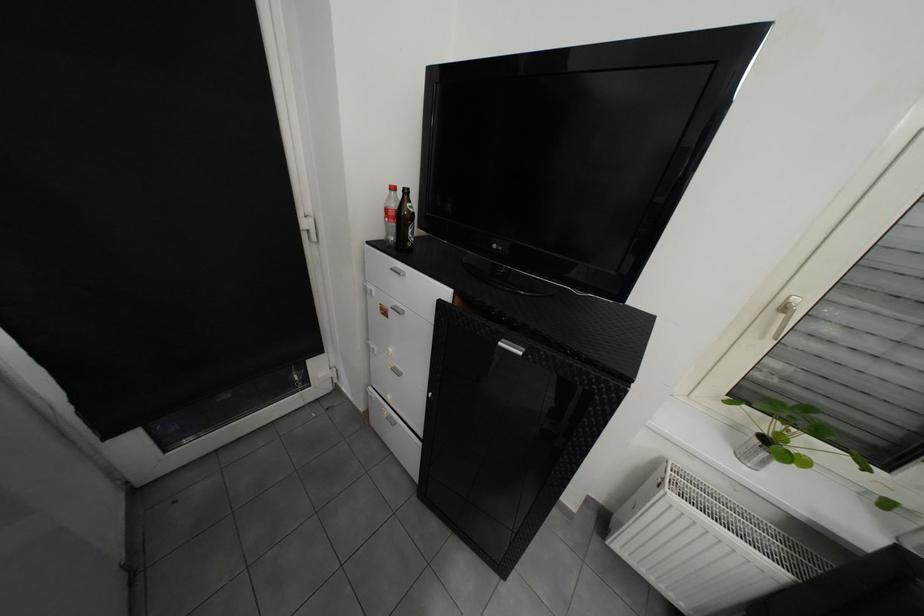
This screenshot has width=924, height=616. What do you see at coordinates (310, 230) in the screenshot?
I see `the white door handle` at bounding box center [310, 230].